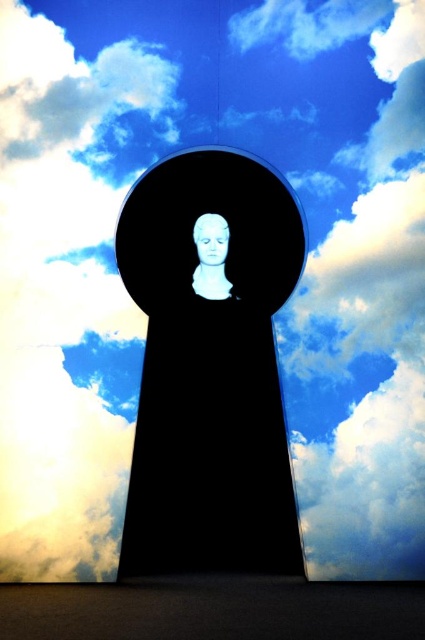
Which is in front, point (200, 278) or point (209, 259)?

Point (200, 278) is in front.

Between point (203, 253) and point (210, 228), which one is positioned behind?

Positioned behind is point (210, 228).

In order to click on white marble bust at center in this screenshot , I will do `click(210, 257)`.